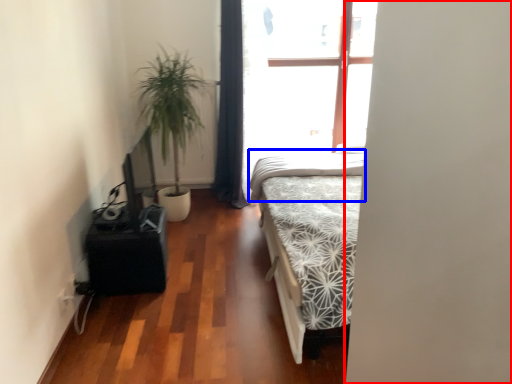
Question: Which object is further to the camera taking this photo, screen door (highlighted by a red box) or mattress (highlighted by a blue box)?

Choices:
 (A) screen door
 (B) mattress

Answer: (B)